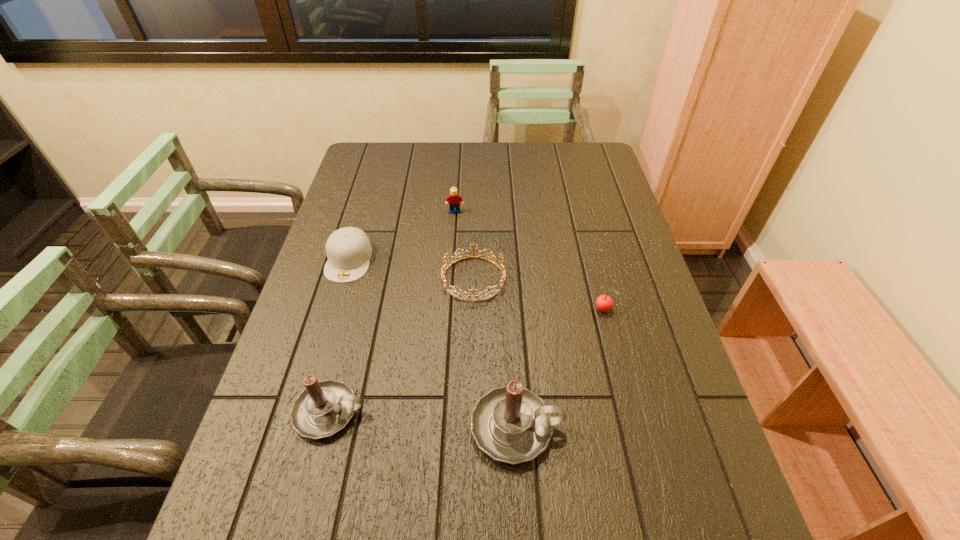
I want to click on the left candle, so click(324, 408).

Identify the location of the shorter candle. click(x=324, y=408).

Locate an element on the screen. the tallest object is located at coordinates (511, 424).

Find the location of a particular element. The height and width of the screenshot is (540, 960). the taller candle is located at coordinates [x=511, y=424].

You are a GUI agent. You are given a task and a screenshot of the screen. Output one action in this format:
    pyautogui.click(x=<x>, y=<y>)
    Task: Click on the Lego
    The image size is (960, 540).
    Given the screenshot: What is the action you would take?
    pyautogui.click(x=455, y=200)

This screenshot has width=960, height=540. In order to click on cap in this screenshot , I will do `click(348, 249)`.

Find the location of a particular element. This screenshot has width=960, height=540. the rightmost object is located at coordinates (604, 303).

What are the coordinates of `tiara` in the screenshot? It's located at (503, 271).

Find the location of a particular element. The height and width of the screenshot is (540, 960). vacant space located on the side of the shorter candle with the handle loop is located at coordinates coord(460,412).

What are the coordinates of `blank space located 0.140m on the side of the tallest object with the handle loop` in the screenshot? It's located at (630, 427).